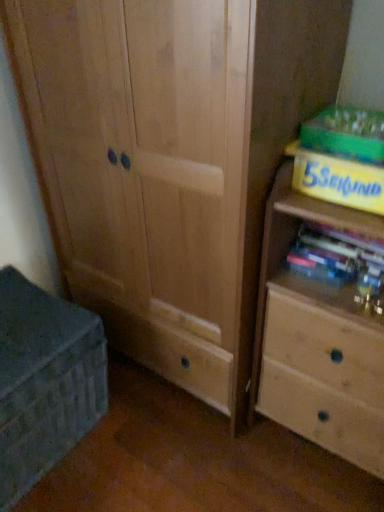
Question: From a real-world perspective, is yellow cardboard book at upper right, the first paperback book when ordered from top to bottom, located beneath light wood chest of drawers at right?

Choices:
 (A) yes
 (B) no

Answer: (B)

Question: Could light wood chest of drawers at right be considered to be inside yellow cardboard book at upper right, which is the 2th paperback book from bottom to top?

Choices:
 (A) yes
 (B) no

Answer: (B)

Question: Considering the relative sizes of yellow cardboard book at upper right, the first paperback book when ordered from top to bottom, and light wood chest of drawers at right in the image provided, is yellow cardboard book at upper right, the first paperback book when ordered from top to bottom, taller than light wood chest of drawers at right?

Choices:
 (A) no
 (B) yes

Answer: (A)

Question: Is yellow cardboard book at upper right, which is the 2th paperback book from bottom to top, directly adjacent to light wood chest of drawers at right?

Choices:
 (A) no
 (B) yes

Answer: (A)

Question: Considering the relative positions of yellow cardboard book at upper right, the first paperback book when ordered from top to bottom, and light wood chest of drawers at right in the image provided, is yellow cardboard book at upper right, the first paperback book when ordered from top to bottom, to the left of light wood chest of drawers at right from the viewer's perspective?

Choices:
 (A) yes
 (B) no

Answer: (A)

Question: Which is correct: light wood chest of drawers at right is inside yellow matte paperback book at upper right, which ranks as the 1th paperback book in bottom-to-top order, or outside of it?

Choices:
 (A) outside
 (B) inside

Answer: (A)

Question: From a real-world perspective, relative to yellow matte paperback book at upper right, which is the second paperback book in top-to-bottom order, is light wood chest of drawers at right vertically above or below?

Choices:
 (A) above
 (B) below

Answer: (B)

Question: In terms of width, does light wood chest of drawers at right look wider or thinner when compared to yellow matte paperback book at upper right, which is the second paperback book in top-to-bottom order?

Choices:
 (A) thin
 (B) wide

Answer: (B)

Question: Does point (344, 424) appear closer or farther from the camera than point (334, 158)?

Choices:
 (A) farther
 (B) closer

Answer: (A)

Question: In terms of size, does matte gray chest at lower left appear bigger or smaller than matte plastic books at right?

Choices:
 (A) big
 (B) small

Answer: (A)

Question: From a real-world perspective, relative to matte plastic books at right, is matte gray chest at lower left vertically above or below?

Choices:
 (A) below
 (B) above

Answer: (A)

Question: Considering the positions of matte gray chest at lower left and matte plastic books at right in the image, is matte gray chest at lower left wider or thinner than matte plastic books at right?

Choices:
 (A) wide
 (B) thin

Answer: (A)

Question: Would you say matte gray chest at lower left is inside or outside matte plastic books at right?

Choices:
 (A) inside
 (B) outside

Answer: (B)

Question: Considering the positions of yellow matte paperback book at upper right, which ranks as the 1th paperback book in bottom-to-top order, and yellow cardboard book at upper right, the first paperback book when ordered from top to bottom, in the image, is yellow matte paperback book at upper right, which ranks as the 1th paperback book in bottom-to-top order, wider or thinner than yellow cardboard book at upper right, the first paperback book when ordered from top to bottom,?

Choices:
 (A) wide
 (B) thin

Answer: (A)

Question: In terms of height, does yellow matte paperback book at upper right, which is the second paperback book in top-to-bottom order, look taller or shorter compared to yellow cardboard book at upper right, the first paperback book when ordered from top to bottom?

Choices:
 (A) tall
 (B) short

Answer: (A)